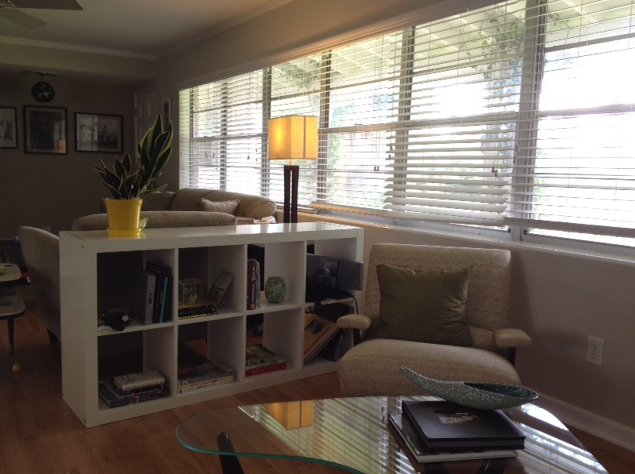
The height and width of the screenshot is (474, 635). What are the coordinates of `clock` in the screenshot? It's located at (42, 89).